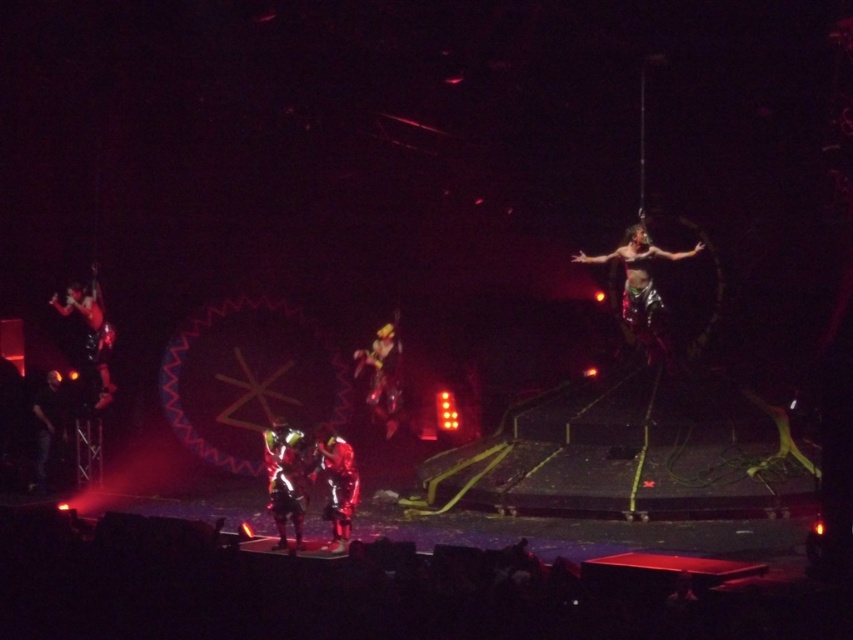
You are an audience member sitting in the front row of the stage. You notice the metallic gold costume at center and the dark fabric figure at left. Which object is closer to you?

The metallic gold costume at center is closer to you because it is further to the viewer than the dark fabric figure at left.

You are a photographer positioned at the front of the stage. You want to capture a closeup of the metallic gold costume at center. Which direction should you move to get closer to it?

Since the metallic gold costume at center is located at point 0.586 on the x axis and 0.450 on the y axis, you should move forward to get closer to it.